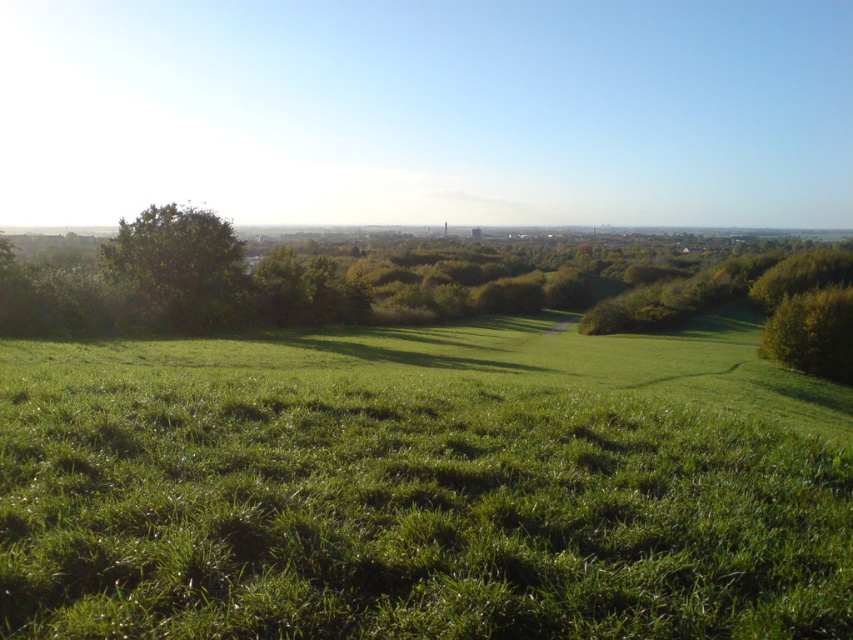
You are standing in the middle of the green grassy field at center and want to walk towards the green leafy tree at right. Which direction should you head to get closer to the tree?

Since the green grassy field at center is in front of the green leafy tree at right, you should head towards the direction of the tree by moving forward from the field towards the tree.

You are standing in the middle of the green grassy field at center and want to walk to the green leafy tree at right. Which direction should you head towards to reach the tree?

You should head towards the right direction to reach the green leafy tree at right since it is located to the right side of the green grassy field at center.